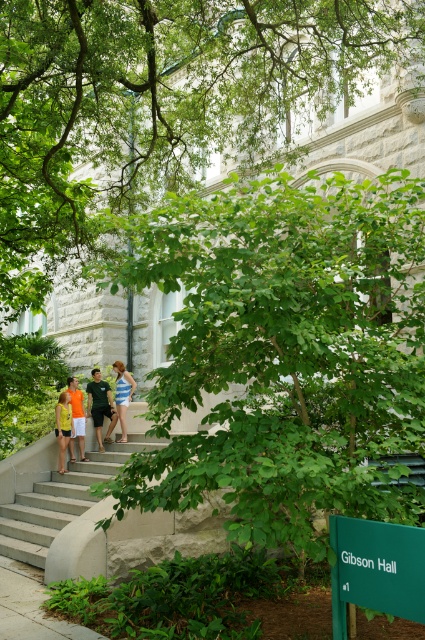
You are a photographer trying to capture a photo of the blue striped dress at center without the green leafy tree at center blocking the view. Based on the scene, can you position yourself in a way that the tree doesn not obstruct the dress?

The green leafy tree at center is wider than the blue striped dress at center. Since the tree is wider, positioning yourself to avoid the tree might be challenging, but if you move to the side opposite the tree, you might be able to frame the dress so the tree isn not directly in front of it.